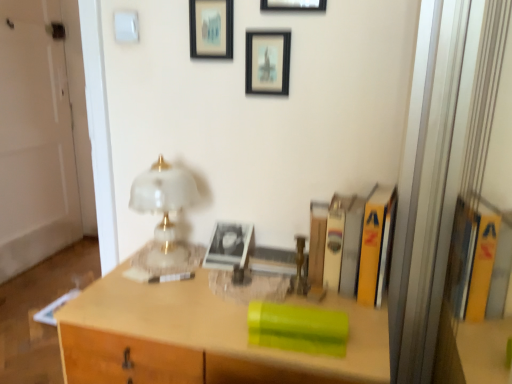
You are a GUI agent. You are given a task and a screenshot of the screen. Output one action in this format:
    pyautogui.click(x=<x>, y=<y>)
    Task: Click on the vacant space in front of green plastic container at center, positioned as the first book in left-to-right order
    
    Given the screenshot: What is the action you would take?
    pyautogui.click(x=306, y=363)